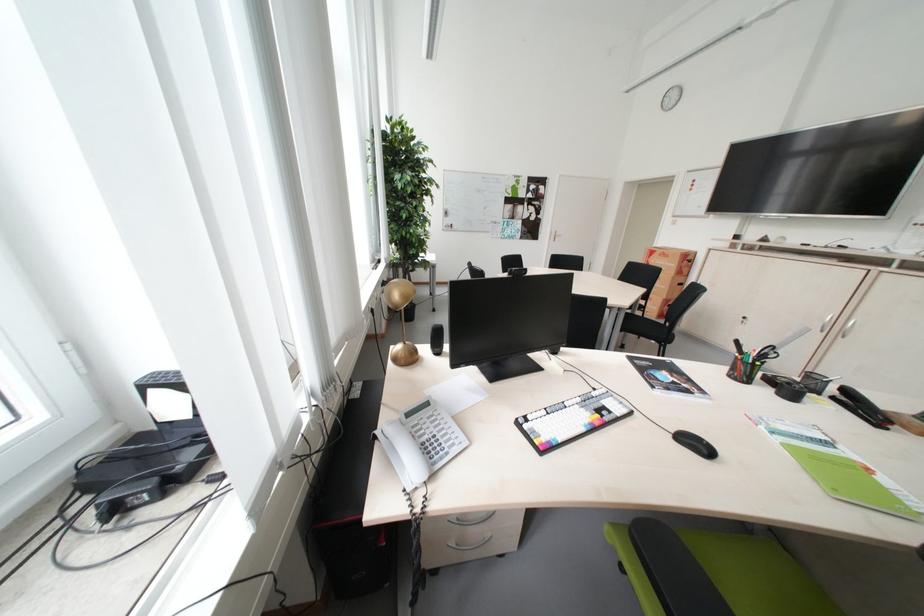
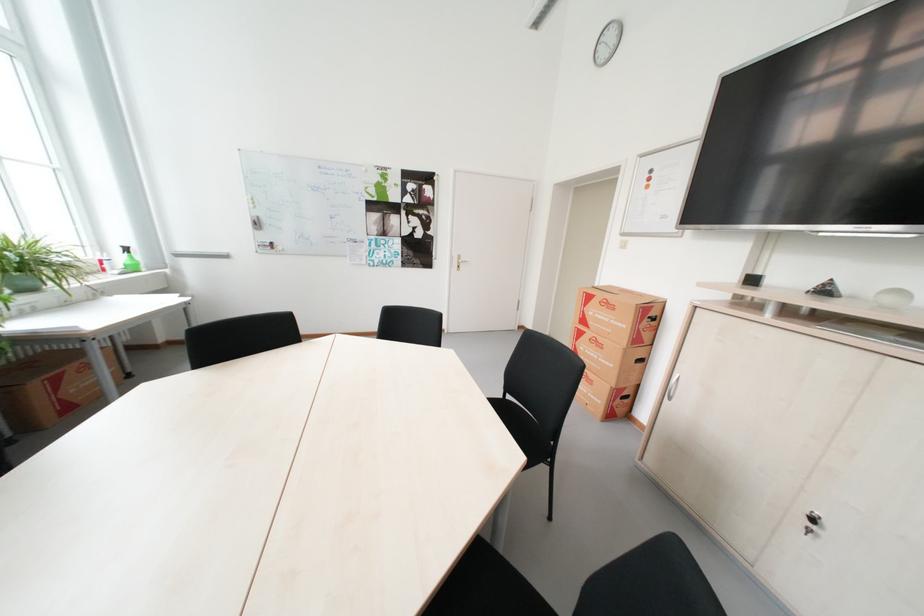
The point at (794, 238) is marked in the first image. Where is the corresponding point in the second image?

(910, 294)